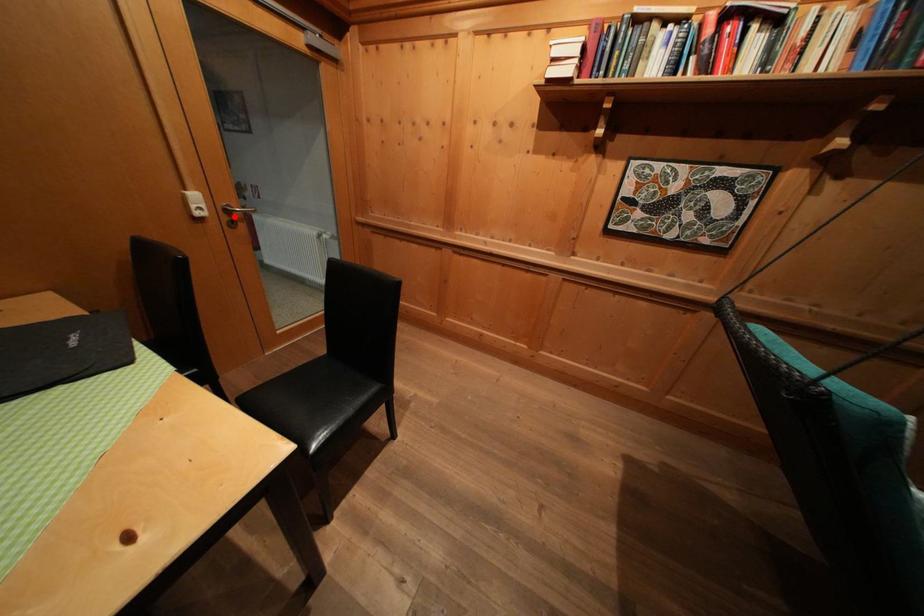
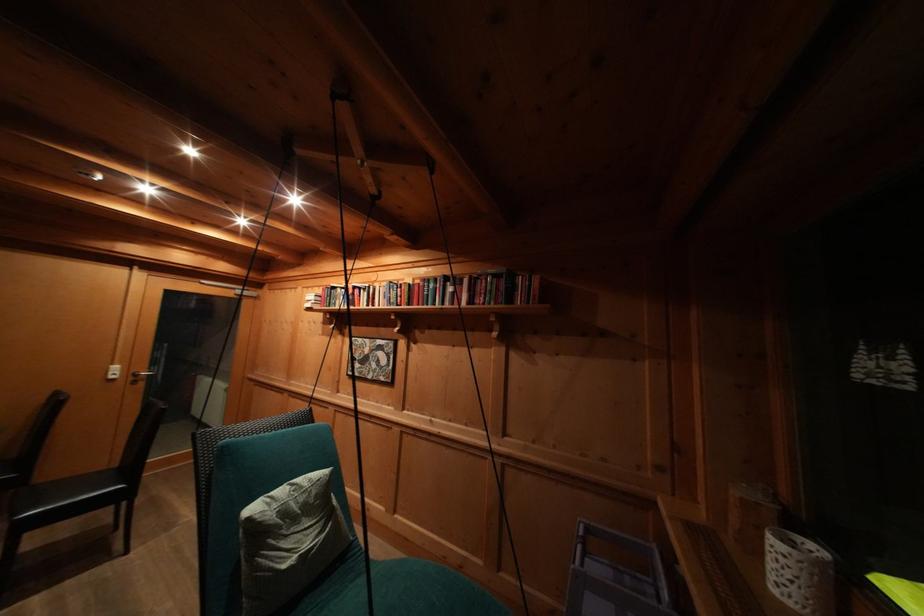
Question: I am providing you with two images of the same scene from different viewpoints. Image1 has a red point marked. In image2, the corresponding 3D location appears at what relative position? Reply with the corresponding letter.

Choices:
 (A) Closer
 (B) Farther

Answer: (B)